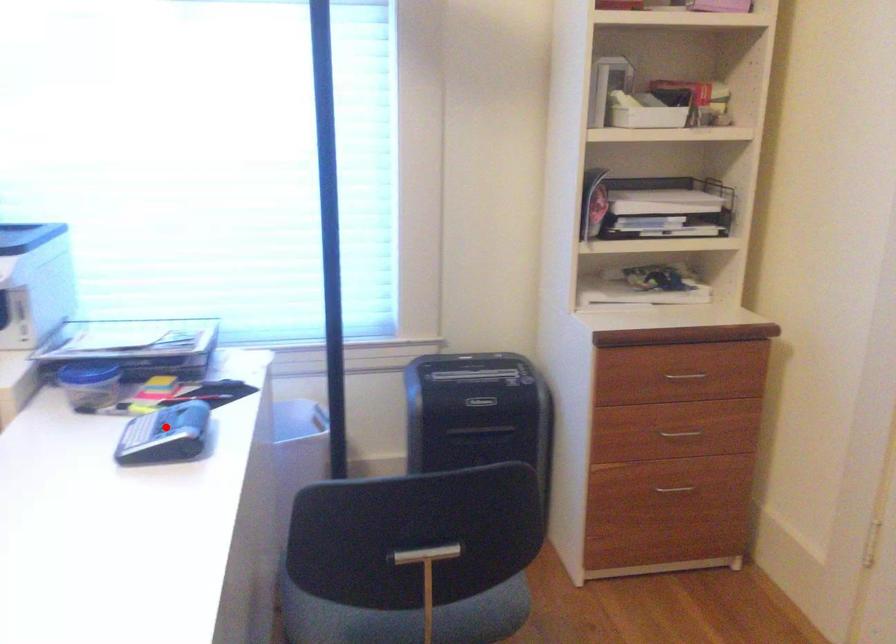
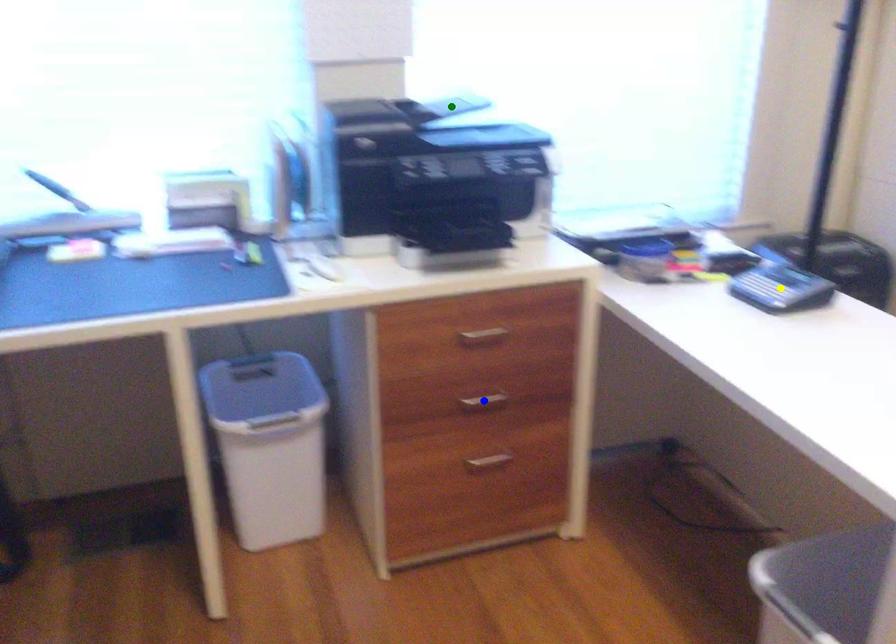
Question: I am providing you with two images of the same scene from different viewpoints. A red point is marked on the first image. You are given multiple points on the second image. Which mark in image 2 goes with the point in image 1?

Choices:
 (A) blue point
 (B) green point
 (C) yellow point

Answer: (C)